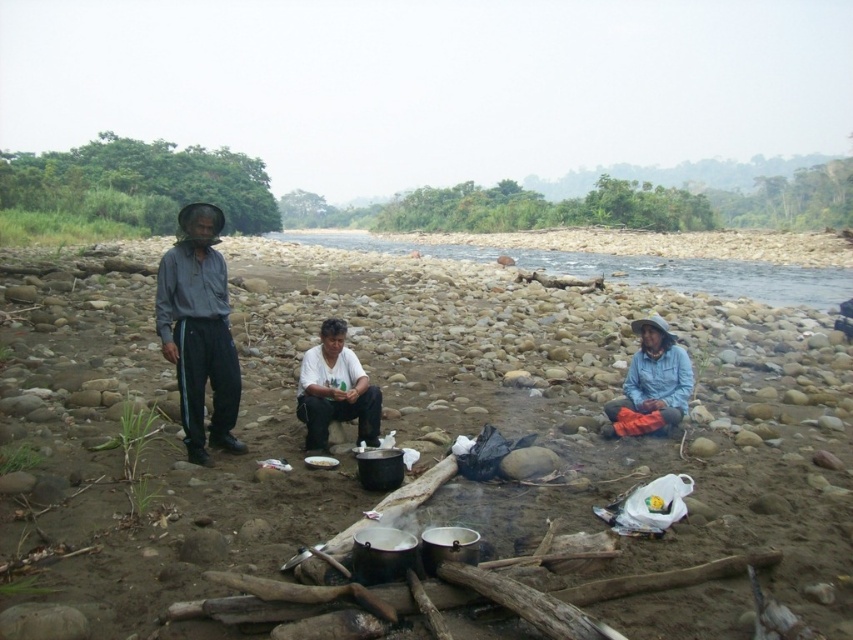
Does white matte shirt at center have a larger size compared to blue denim jacket at lower right?

No, white matte shirt at center is not bigger than blue denim jacket at lower right.

Where is `white matte shirt at center`? white matte shirt at center is located at coordinates (335, 388).

Where is `white matte shirt at center`? white matte shirt at center is located at coordinates (335, 388).

Is gray fabric shirt at left taller than blue denim jacket at lower right?

Correct, gray fabric shirt at left is much taller as blue denim jacket at lower right.

Can you confirm if gray fabric shirt at left is thinner than blue denim jacket at lower right?

Incorrect, gray fabric shirt at left's width is not less than blue denim jacket at lower right's.

I want to click on gray fabric shirt at left, so click(x=199, y=330).

At what (x,y) coordinates should I click in order to perform the action: click on gray fabric shirt at left. Please return your answer as a coordinate pair (x, y). The height and width of the screenshot is (640, 853). Looking at the image, I should click on (199, 330).

Does gray fabric shirt at left have a lesser width compared to white matte shirt at center?

No, gray fabric shirt at left is not thinner than white matte shirt at center.

Does gray fabric shirt at left come behind white matte shirt at center?

No, it is in front of white matte shirt at center.

Does point (161, 275) come closer to viewer compared to point (318, 353)?

Yes.

At what (x,y) coordinates should I click in order to perform the action: click on gray fabric shirt at left. Please return your answer as a coordinate pair (x, y). The height and width of the screenshot is (640, 853). Looking at the image, I should click on (199, 330).